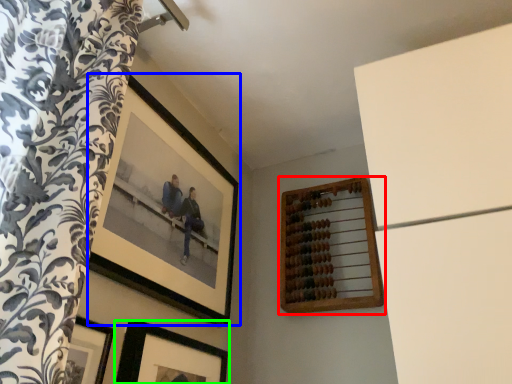
Question: Estimate the real-world distances between objects in this image. Which object is closer to picture frame (highlighted by a red box), picture frame (highlighted by a blue box) or picture frame (highlighted by a green box)?

Choices:
 (A) picture frame
 (B) picture frame

Answer: (A)